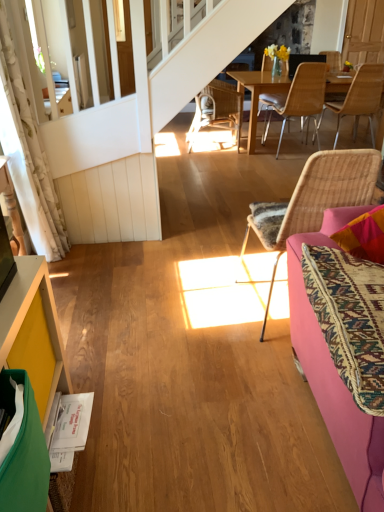
This screenshot has height=512, width=384. I want to click on free point to the left of woven rattan chair at center, the 3th chair positioned from the right, so click(x=206, y=309).